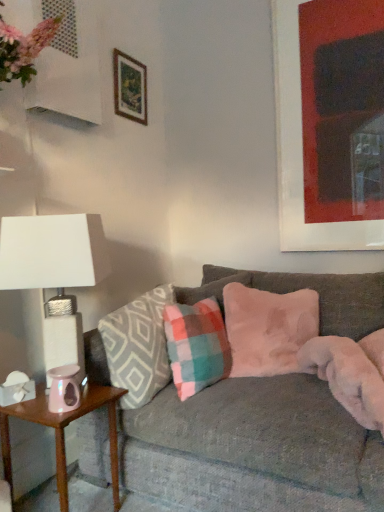
What is the approximate width of fuzzy pink pillow at center, the 1th pillow from the right?

The width of fuzzy pink pillow at center, the 1th pillow from the right, is 13.70 inches.

This screenshot has width=384, height=512. In order to click on plaid fabric pillow at center, which is the first pillow from left to right in this screenshot , I will do point(138,347).

The width and height of the screenshot is (384, 512). What do you see at coordinates (253, 448) in the screenshot? I see `velvet gray couch at center` at bounding box center [253, 448].

Where is `matte black picture frame at upper right, which appears as the first picture frame when viewed from the right`? The height and width of the screenshot is (512, 384). matte black picture frame at upper right, which appears as the first picture frame when viewed from the right is located at coordinates (302, 152).

The height and width of the screenshot is (512, 384). In order to click on the 1st pillow behind the iridescent glass candle holder at lower left, starting your count from the anchor in this screenshot , I will do `click(138, 347)`.

Which is less distant, (53,410) or (160,360)?

Point (53,410) is closer to the camera than point (160,360).

Is iridescent glass candle holder at lower left in contact with plaid fabric pillow at center, positioned as the 3th pillow in right-to-left order?

No, iridescent glass candle holder at lower left is not with plaid fabric pillow at center, positioned as the 3th pillow in right-to-left order.

Relative to plaid fabric pillow at center, which is the first pillow from left to right, is iridescent glass candle holder at lower left in front or behind?

iridescent glass candle holder at lower left is in front of plaid fabric pillow at center, which is the first pillow from left to right.

From a real-world perspective, is pink glossy side table at lower left positioned above or below matte black picture frame at upper right, the second picture frame from the left?

In terms of real-world spatial position, pink glossy side table at lower left is below matte black picture frame at upper right, the second picture frame from the left.

Does pink glossy side table at lower left lie behind matte black picture frame at upper right, the second picture frame from the left?

No, pink glossy side table at lower left is closer to the viewer.

Is pink glossy side table at lower left aimed at matte black picture frame at upper right, the second picture frame from the left?

No, pink glossy side table at lower left is not oriented towards matte black picture frame at upper right, the second picture frame from the left.

Does pink glossy side table at lower left have a larger size compared to matte black picture frame at upper right, which appears as the first picture frame when viewed from the right?

Indeed, pink glossy side table at lower left has a larger size compared to matte black picture frame at upper right, which appears as the first picture frame when viewed from the right.

Considering the positions of point (70, 256) and point (140, 117), is point (70, 256) closer or farther from the camera than point (140, 117)?

Point (70, 256) is positioned closer to the camera compared to point (140, 117).

From a real-world perspective, which object stands above the other?

wooden picture frame at upper center, which is the second picture frame in right-to-left order, is physically above.

Which object is thinner, white textured lampshade at left or wooden picture frame at upper center, acting as the first picture frame starting from the left?

wooden picture frame at upper center, acting as the first picture frame starting from the left.

Would you say white textured lampshade at left is inside or outside wooden picture frame at upper center, acting as the first picture frame starting from the left?

white textured lampshade at left is located beyond the bounds of wooden picture frame at upper center, acting as the first picture frame starting from the left.

In the scene shown: Who is smaller, matte black picture frame at upper right, the second picture frame from the left, or plaid fabric pillow at center, which is the second pillow in left-to-right order?

matte black picture frame at upper right, the second picture frame from the left, is smaller.

Locate an element on the screen. Image resolution: width=384 pixels, height=512 pixels. the 2nd pillow in front of the matte black picture frame at upper right, the second picture frame from the left is located at coordinates (196, 345).

Could you tell me if matte black picture frame at upper right, which appears as the first picture frame when viewed from the right, is turned towards plaid fabric pillow at center, acting as the second pillow starting from the right?

Yes, matte black picture frame at upper right, which appears as the first picture frame when viewed from the right, is facing plaid fabric pillow at center, acting as the second pillow starting from the right.

Is point (317, 248) farther from camera compared to point (213, 350)?

Yes, point (317, 248) is farther from viewer.

Does velvet gray couch at center appear on the right side of white textured lampshade at left?

Indeed, velvet gray couch at center is positioned on the right side of white textured lampshade at left.

This screenshot has height=512, width=384. What are the coordinates of `table lamp above the velvet gray couch at center (from the image's perspective)` in the screenshot? It's located at tap(55, 273).

Measure the distance between velvet gray couch at center and white textured lampshade at left.

16.97 inches.

Consider the image. Is velvet gray couch at center not close to white textured lampshade at left?

No, there isn't a large distance between velvet gray couch at center and white textured lampshade at left.

At what (x,y) coordinates should I click in order to perform the action: click on pillow that is on the right side of plaid fabric pillow at center, which is the second pillow in left-to-right order. Please return your answer as a coordinate pair (x, y). The image size is (384, 512). Looking at the image, I should click on (268, 329).

In the scene shown: Is fuzzy pink pillow at center, the 1th pillow from the right, closer to camera compared to plaid fabric pillow at center, acting as the second pillow starting from the right?

No, it is behind plaid fabric pillow at center, acting as the second pillow starting from the right.

From a real-world perspective, which object rests below the other?

plaid fabric pillow at center, which is the second pillow in left-to-right order.

Between point (179, 325) and point (94, 388), which one is positioned in front?

The point (94, 388) is closer to the camera.

Is pink glossy side table at lower left surrounded by plaid fabric pillow at center, acting as the second pillow starting from the right?

No, pink glossy side table at lower left is not inside plaid fabric pillow at center, acting as the second pillow starting from the right.

Considering the relative sizes of plaid fabric pillow at center, acting as the second pillow starting from the right, and pink glossy side table at lower left in the image provided, is plaid fabric pillow at center, acting as the second pillow starting from the right, taller than pink glossy side table at lower left?

No.

Consider the image. Considering the relative positions of plaid fabric pillow at center, acting as the second pillow starting from the right, and pink glossy side table at lower left in the image provided, is plaid fabric pillow at center, acting as the second pillow starting from the right, to the left or to the right of pink glossy side table at lower left?

plaid fabric pillow at center, acting as the second pillow starting from the right, is to the right of pink glossy side table at lower left.

This screenshot has height=512, width=384. What are the coordinates of `candle holder in front of the plaid fabric pillow at center, which is the first pillow from left to right` in the screenshot? It's located at (64, 388).

Identify the location of the 1st picture frame positioned above the pink glossy side table at lower left (from a real-world perspective). (302, 152).

When comparing their distances from white textured lampshade at left, does pink glossy side table at lower left or plaid fabric pillow at center, which is the first pillow from left to right, seem closer?

plaid fabric pillow at center, which is the first pillow from left to right, lies closer to white textured lampshade at left than the other object.

Based on their spatial positions, is iridescent glass candle holder at lower left or velvet gray couch at center further from plaid fabric pillow at center, which is the second pillow in left-to-right order?

iridescent glass candle holder at lower left.

Estimate the real-world distances between objects in this image. Which object is further from iridescent glass candle holder at lower left, wooden picture frame at upper center, which is the second picture frame in right-to-left order, or plaid fabric pillow at center, positioned as the 3th pillow in right-to-left order?

The object further to iridescent glass candle holder at lower left is wooden picture frame at upper center, which is the second picture frame in right-to-left order.

Considering their positions, is matte black picture frame at upper right, which appears as the first picture frame when viewed from the right, positioned closer to plaid fabric pillow at center, acting as the second pillow starting from the right, than velvet gray couch at center?

velvet gray couch at center.

Which object lies further to the anchor point white textured lampshade at left, plaid fabric pillow at center, which is the first pillow from left to right, or plaid fabric pillow at center, which is the second pillow in left-to-right order?

plaid fabric pillow at center, which is the second pillow in left-to-right order, is further to white textured lampshade at left.

Which object lies nearer to the anchor point velvet gray couch at center, white textured lampshade at left or iridescent glass candle holder at lower left?

The object closer to velvet gray couch at center is white textured lampshade at left.

Considering their positions, is velvet gray couch at center positioned closer to iridescent glass candle holder at lower left than pink glossy side table at lower left?

Based on the image, pink glossy side table at lower left appears to be nearer to iridescent glass candle holder at lower left.

Estimate the real-world distances between objects in this image. Which object is closer to white textured lampshade at left, velvet gray couch at center or plaid fabric pillow at center, acting as the second pillow starting from the right?

velvet gray couch at center is positioned closer to the anchor white textured lampshade at left.

Locate an element on the screen. This screenshot has height=512, width=384. candle holder between wooden picture frame at upper center, which is the second picture frame in right-to-left order, and velvet gray couch at center vertically is located at coordinates (64, 388).

The image size is (384, 512). Identify the location of picture frame between wooden picture frame at upper center, acting as the first picture frame starting from the left, and pink glossy side table at lower left, in the vertical direction. (302, 152).

Image resolution: width=384 pixels, height=512 pixels. What are the coordinates of `pillow between matte black picture frame at upper right, which appears as the first picture frame when viewed from the right, and plaid fabric pillow at center, positioned as the 3th pillow in right-to-left order, in the up-down direction` in the screenshot? It's located at (268, 329).

Identify the location of picture frame between wooden picture frame at upper center, acting as the first picture frame starting from the left, and velvet gray couch at center in the up-down direction. Image resolution: width=384 pixels, height=512 pixels. (302, 152).